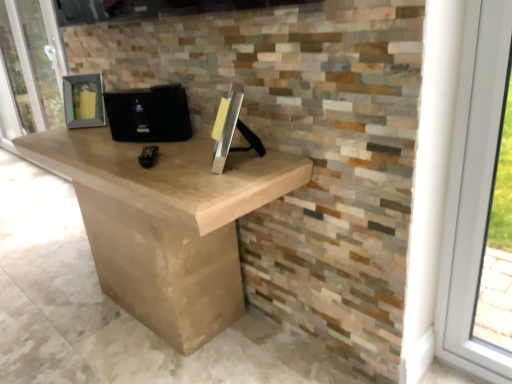
Question: Is matte gray frame at left wider or thinner than black matte speaker at center?

Choices:
 (A) thin
 (B) wide

Answer: (A)

Question: Is matte gray frame at left to the left or to the right of black matte speaker at center in the image?

Choices:
 (A) left
 (B) right

Answer: (A)

Question: From a real-world perspective, relative to black matte speaker at center, is matte gray frame at left vertically above or below?

Choices:
 (A) below
 (B) above

Answer: (A)

Question: Is point (179, 91) positioned closer to the camera than point (30, 23)?

Choices:
 (A) farther
 (B) closer

Answer: (B)

Question: Based on their positions, is black matte speaker at center located to the left or right of matte gray frame at left?

Choices:
 (A) right
 (B) left

Answer: (A)

Question: Considering the positions of black matte speaker at center and matte gray frame at left in the image, is black matte speaker at center taller or shorter than matte gray frame at left?

Choices:
 (A) tall
 (B) short

Answer: (B)

Question: Considering the positions of black matte speaker at center and matte gray frame at left in the image, is black matte speaker at center bigger or smaller than matte gray frame at left?

Choices:
 (A) small
 (B) big

Answer: (A)